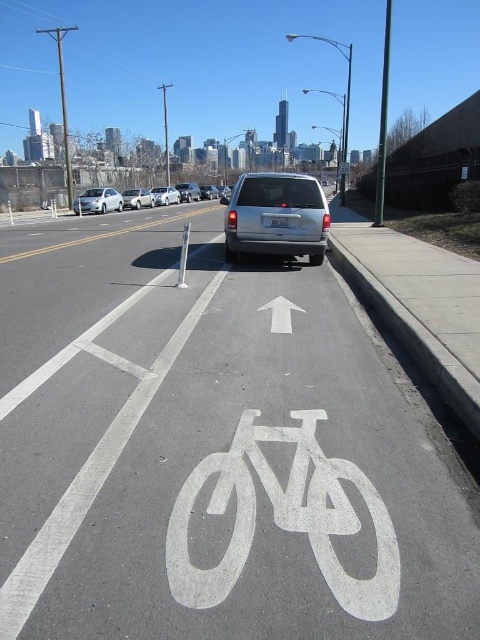
In the scene shown: Is white painted bicycle lane at center in front of satin silver van at center?

Yes.

Is point (348, 532) positioned before point (193, 193)?

Yes, it is.

Identify the location of white painted bicycle lane at center. (214, 454).

Does white matte sedan at left have a smaller size compared to silver metallic sedan at center?

Incorrect, white matte sedan at left is not smaller in size than silver metallic sedan at center.

Which is more to the left, white matte sedan at left or silver metallic sedan at center?

white matte sedan at left is more to the left.

Describe the element at coordinates (97, 200) in the screenshot. I see `white matte sedan at left` at that location.

You are a GUI agent. You are given a task and a screenshot of the screen. Output one action in this format:
    pyautogui.click(x=<x>, y=<y>)
    Task: Click on the white matte sedan at left
    This screenshot has width=480, height=640.
    Given the screenshot: What is the action you would take?
    pyautogui.click(x=97, y=200)

How far apart are white painted bicycle at center and satin silver suv at center?

They are 56.63 feet apart.

Is point (241, 529) closer to viewer compared to point (212, 186)?

That is True.

Does point (295, 518) lie in front of point (210, 193)?

Yes.

The width and height of the screenshot is (480, 640). I want to click on white painted bicycle at center, so click(284, 516).